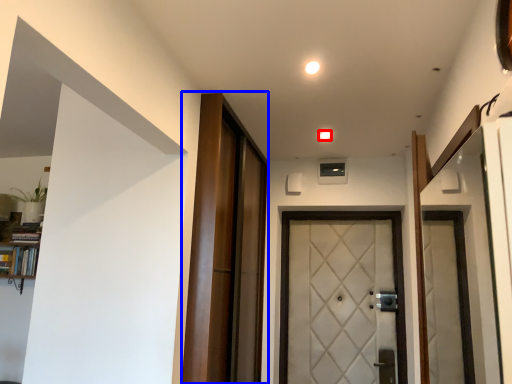
Question: Which object appears farthest to the camera in this image, light (highlighted by a red box) or barn door (highlighted by a blue box)?

Choices:
 (A) light
 (B) barn door

Answer: (A)